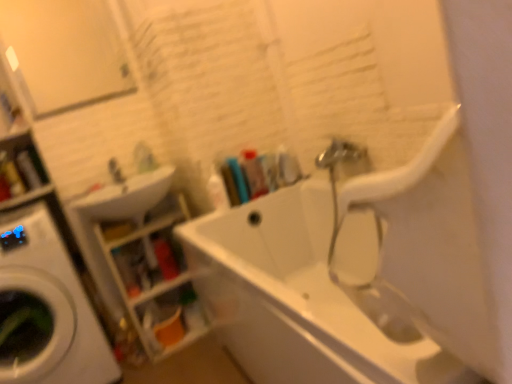
Where is `free spot above white glossy sink at upper left (from a real-world perspective)`? The width and height of the screenshot is (512, 384). free spot above white glossy sink at upper left (from a real-world perspective) is located at coordinates (118, 189).